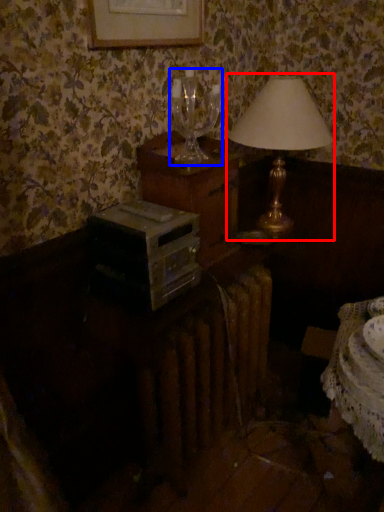
Question: Among these objects, which one is farthest to the camera, lamp (highlighted by a red box) or wine glass (highlighted by a blue box)?

Choices:
 (A) lamp
 (B) wine glass

Answer: (A)